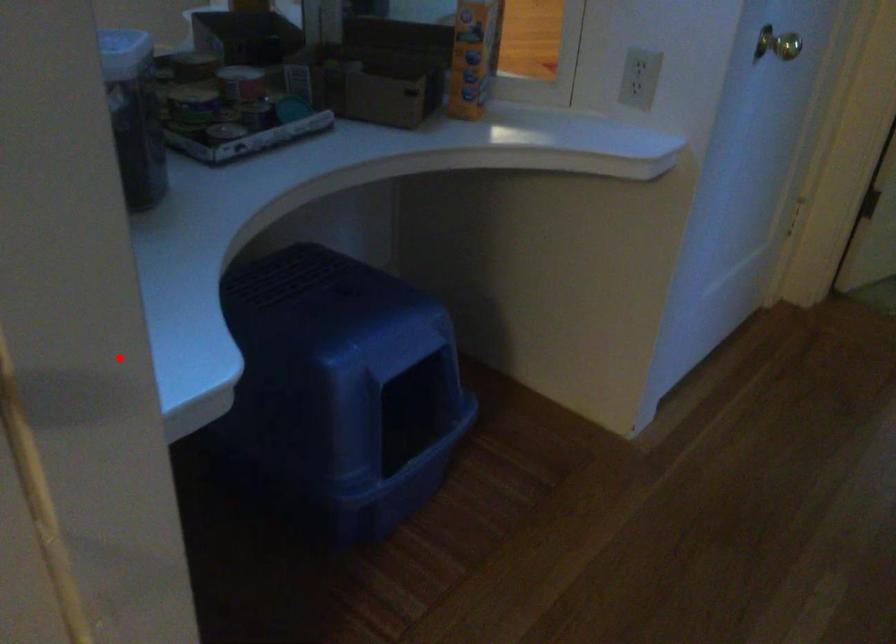
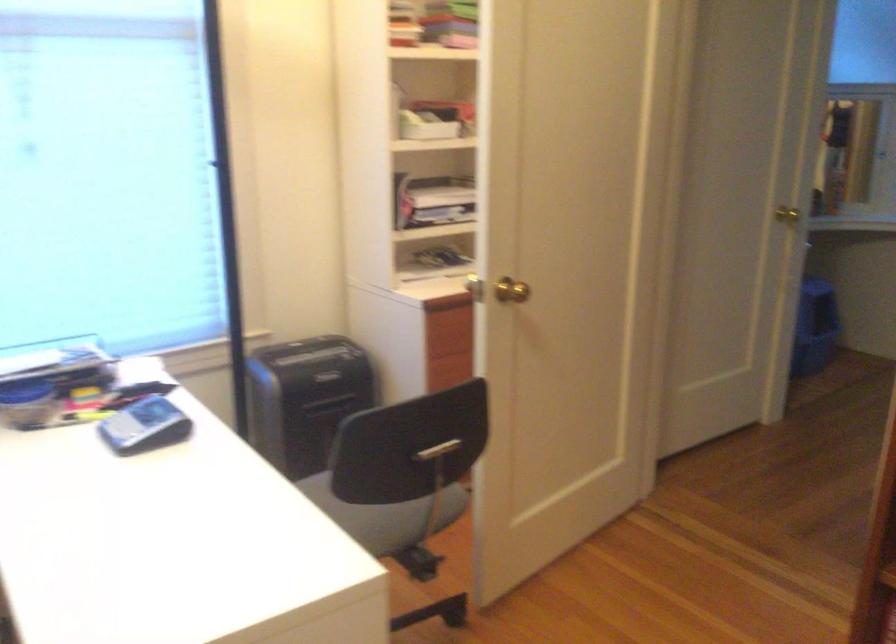
Question: I am providing you with two images of the same scene from different viewpoints. A red point is marked on the first image. Can you still see the location of the red point in image 2?

Choices:
 (A) Yes
 (B) No

Answer: (A)